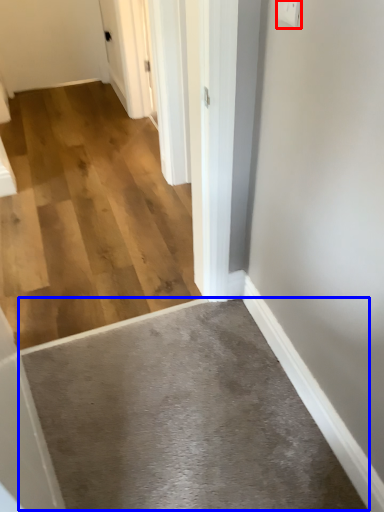
Question: Which point is further to the camera, electric outlet (highlighted by a red box) or concrete (highlighted by a blue box)?

Choices:
 (A) electric outlet
 (B) concrete

Answer: (B)